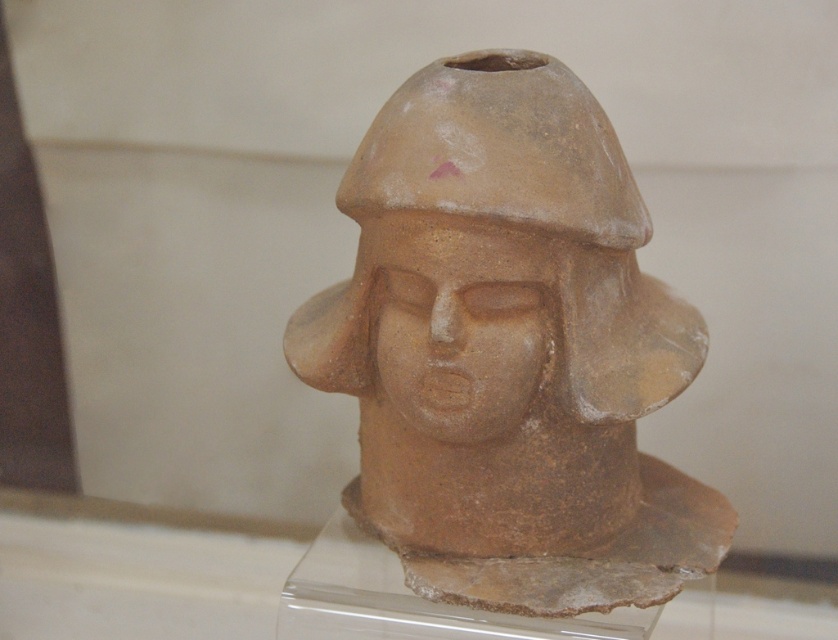
Which is in front, point (353, 356) or point (448, 227)?

Point (448, 227) is in front.

Can you confirm if matte clay bust at center is taller than matte clay face at center?

Yes.

Which is in front, point (566, 419) or point (442, 376)?

Point (442, 376) is more forward.

Where is `matte clay bust at center`? Image resolution: width=838 pixels, height=640 pixels. matte clay bust at center is located at coordinates (510, 349).